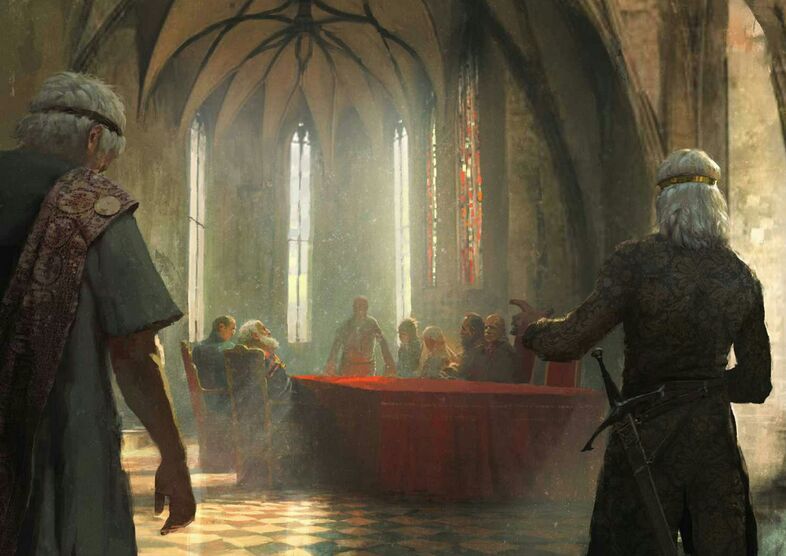
The image size is (786, 556). I want to click on window, so click(x=180, y=210), click(x=296, y=233), click(x=397, y=225).